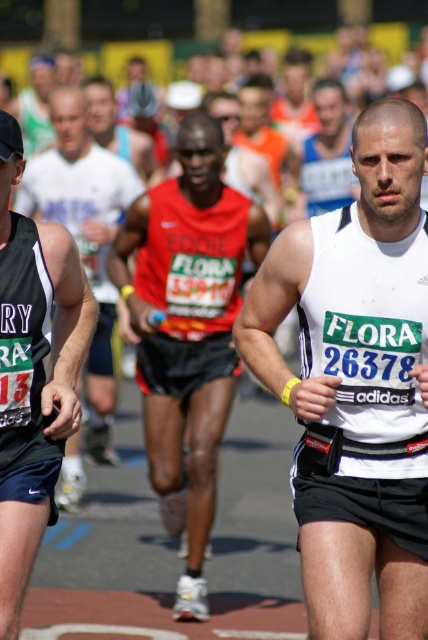
Does white matte singlet at center have a smaller size compared to red fabric shirt at center?

Yes, white matte singlet at center is smaller than red fabric shirt at center.

Between white matte singlet at center and red fabric shirt at center, which one has more height?

Standing taller between the two is red fabric shirt at center.

Image resolution: width=428 pixels, height=640 pixels. What do you see at coordinates (356, 381) in the screenshot?
I see `white matte singlet at center` at bounding box center [356, 381].

Locate an element on the screen. Image resolution: width=428 pixels, height=640 pixels. white matte singlet at center is located at coordinates (356, 381).

Who is taller, white matte singlet at center or red mesh tank top at center?

Standing taller between the two is red mesh tank top at center.

Is white matte singlet at center to the left of red mesh tank top at center from the viewer's perspective?

In fact, white matte singlet at center is to the right of red mesh tank top at center.

Who is more distant from viewer, (368,525) or (74,129)?

The point (74,129) is more distant.

Identify the location of white matte singlet at center. (356, 381).

Can you confirm if red fabric shirt at center is bigger than red mesh tank top at center?

No.

Is point (198, 403) closer to camera compared to point (76, 118)?

Yes, point (198, 403) is in front of point (76, 118).

Is point (216, 269) farther from viewer compared to point (103, 346)?

No, it is in front of (103, 346).

Where is `red fabric shirt at center`? red fabric shirt at center is located at coordinates (187, 330).